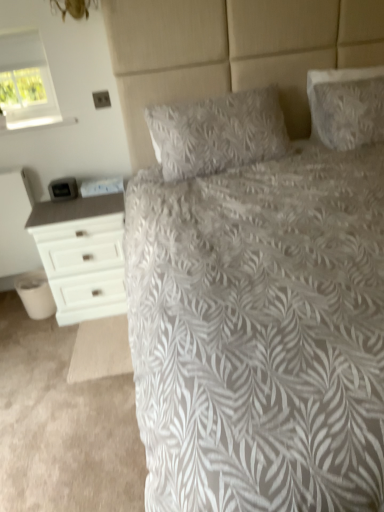
Describe the element at coordinates (16, 224) in the screenshot. I see `white painted wood nightstand at left` at that location.

Locate an element on the screen. white textured pillow at upper right, which ranks as the first pillow in right-to-left order is located at coordinates (347, 106).

Image resolution: width=384 pixels, height=512 pixels. What do you see at coordinates (26, 82) in the screenshot?
I see `white fabric window at upper left` at bounding box center [26, 82].

The width and height of the screenshot is (384, 512). What do you see at coordinates (80, 252) in the screenshot?
I see `white wood chest of drawers at left` at bounding box center [80, 252].

I want to click on white textured pillow at center, the second pillow in the right-to-left sequence, so click(x=218, y=133).

Is white textured pillow at center, positioned as the 1th pillow in left-to-right order, in front of or behind white textured bed at center in the image?

In the image, white textured pillow at center, positioned as the 1th pillow in left-to-right order, appears behind white textured bed at center.

How different are the orientations of white textured pillow at center, positioned as the 1th pillow in left-to-right order, and white textured bed at center in degrees?

There is a 1.22-degree angle between the facing directions of white textured pillow at center, positioned as the 1th pillow in left-to-right order, and white textured bed at center.

Can you confirm if white textured pillow at center, the second pillow in the right-to-left sequence, is smaller than white textured bed at center?

Correct, white textured pillow at center, the second pillow in the right-to-left sequence, occupies less space than white textured bed at center.

Is white textured pillow at center, the second pillow in the right-to-left sequence, facing towards white textured bed at center?

Yes, white textured pillow at center, the second pillow in the right-to-left sequence, faces towards white textured bed at center.

Is white wood chest of drawers at left to the left or to the right of white painted wood nightstand at left in the image?

white wood chest of drawers at left is positioned on white painted wood nightstand at left's right side.

Which of these two, white wood chest of drawers at left or white painted wood nightstand at left, stands shorter?

Standing shorter between the two is white wood chest of drawers at left.

Is white wood chest of drawers at left touching white painted wood nightstand at left?

No, white wood chest of drawers at left is not with white painted wood nightstand at left.

This screenshot has width=384, height=512. What are the coordinates of `chest of drawers located on the right of white painted wood nightstand at left` in the screenshot? It's located at (80, 252).

From the image's perspective, is white textured bed at center on white wood chest of drawers at left?

Correct, white textured bed at center appears higher than white wood chest of drawers at left in the image.

The width and height of the screenshot is (384, 512). Find the location of `chest of drawers lying on the left of white textured bed at center`. chest of drawers lying on the left of white textured bed at center is located at coordinates (80, 252).

Can you tell me how much white textured bed at center and white wood chest of drawers at left differ in facing direction?

3.6 degrees separate the facing orientations of white textured bed at center and white wood chest of drawers at left.

Is white fabric window at upper left taller or shorter than white wood chest of drawers at left?

Considering their sizes, white fabric window at upper left has less height than white wood chest of drawers at left.

Measure the distance between white fabric window at upper left and white wood chest of drawers at left.

30.23 inches.

This screenshot has height=512, width=384. In order to click on window located on the left of white wood chest of drawers at left in this screenshot , I will do `click(26, 82)`.

How many degrees apart are the facing directions of white textured bed at center and white textured pillow at upper right, the second pillow positioned from the left?

There is a 1.22-degree angle between the facing directions of white textured bed at center and white textured pillow at upper right, the second pillow positioned from the left.

From the image's perspective, which is below, white textured bed at center or white textured pillow at upper right, the second pillow positioned from the left?

white textured bed at center appears lower in the image.

Is white textured bed at center directly adjacent to white textured pillow at upper right, which ranks as the first pillow in right-to-left order?

No, white textured bed at center is not next to white textured pillow at upper right, which ranks as the first pillow in right-to-left order.

How much distance is there between white textured bed at center and white textured pillow at upper right, the second pillow positioned from the left?

white textured bed at center is 36.25 inches from white textured pillow at upper right, the second pillow positioned from the left.

From a real-world perspective, is white textured pillow at center, the second pillow in the right-to-left sequence, located higher than white textured pillow at upper right, the second pillow positioned from the left?

No, from a real-world perspective, white textured pillow at center, the second pillow in the right-to-left sequence, is not on top of white textured pillow at upper right, the second pillow positioned from the left.

Is white textured pillow at center, positioned as the 1th pillow in left-to-right order, facing towards white textured pillow at upper right, which ranks as the first pillow in right-to-left order?

No, white textured pillow at center, positioned as the 1th pillow in left-to-right order, is not facing towards white textured pillow at upper right, which ranks as the first pillow in right-to-left order.

Considering the sizes of objects white textured pillow at center, positioned as the 1th pillow in left-to-right order, and white textured pillow at upper right, the second pillow positioned from the left, in the image provided, who is wider, white textured pillow at center, positioned as the 1th pillow in left-to-right order, or white textured pillow at upper right, the second pillow positioned from the left,?

With larger width is white textured pillow at center, positioned as the 1th pillow in left-to-right order.

From the image's perspective, which one is positioned lower, white textured pillow at center, positioned as the 1th pillow in left-to-right order, or white textured pillow at upper right, which ranks as the first pillow in right-to-left order?

white textured pillow at center, positioned as the 1th pillow in left-to-right order, from the image's perspective.

Which is behind, white fabric window at upper left or white painted wood nightstand at left?

white painted wood nightstand at left is more distant.

The width and height of the screenshot is (384, 512). In order to click on window above the white painted wood nightstand at left (from a real-world perspective) in this screenshot , I will do `click(26, 82)`.

Can you confirm if white fabric window at upper left is positioned to the right of white painted wood nightstand at left?

Yes, white fabric window at upper left is to the right of white painted wood nightstand at left.

Image resolution: width=384 pixels, height=512 pixels. I want to click on bed on the right of white textured pillow at center, positioned as the 1th pillow in left-to-right order, so click(256, 314).

I want to click on nightstand that appears above the white wood chest of drawers at left (from a real-world perspective), so click(16, 224).

In the scene shown: Considering their positions, is white textured bed at center positioned further to white textured pillow at upper right, which ranks as the first pillow in right-to-left order, than white wood chest of drawers at left?

white wood chest of drawers at left is positioned further to the anchor white textured pillow at upper right, which ranks as the first pillow in right-to-left order.

Based on their spatial positions, is white textured pillow at upper right, the second pillow positioned from the left, or white wood chest of drawers at left closer to white textured bed at center?

Based on the image, white wood chest of drawers at left appears to be nearer to white textured bed at center.

Estimate the real-world distances between objects in this image. Which object is closer to white fabric window at upper left, white textured bed at center or white wood chest of drawers at left?

The object closer to white fabric window at upper left is white wood chest of drawers at left.

Which object lies further to the anchor point white fabric window at upper left, white painted wood nightstand at left or white textured bed at center?

The object further to white fabric window at upper left is white textured bed at center.

Considering their positions, is white textured bed at center positioned further to white painted wood nightstand at left than white textured pillow at center, the second pillow in the right-to-left sequence?

Among the two, white textured bed at center is located further to white painted wood nightstand at left.

Which object lies further to the anchor point white textured pillow at center, positioned as the 1th pillow in left-to-right order, white textured pillow at upper right, which ranks as the first pillow in right-to-left order, or white textured bed at center?

white textured bed at center is positioned further to the anchor white textured pillow at center, positioned as the 1th pillow in left-to-right order.

Considering their positions, is white painted wood nightstand at left positioned closer to white textured pillow at center, positioned as the 1th pillow in left-to-right order, than white wood chest of drawers at left?

Based on the image, white wood chest of drawers at left appears to be nearer to white textured pillow at center, positioned as the 1th pillow in left-to-right order.

When comparing their distances from white textured pillow at upper right, the second pillow positioned from the left, does white fabric window at upper left or white painted wood nightstand at left seem closer?

white fabric window at upper left lies closer to white textured pillow at upper right, the second pillow positioned from the left, than the other object.

Locate an element on the screen. The width and height of the screenshot is (384, 512). pillow between white wood chest of drawers at left and white textured pillow at upper right, the second pillow positioned from the left, from left to right is located at coordinates (218, 133).

The image size is (384, 512). I want to click on nightstand that lies between white fabric window at upper left and white wood chest of drawers at left from top to bottom, so click(x=16, y=224).

Where is `the chest of drawers located between white textured bed at center and white painted wood nightstand at left in the depth direction`? This screenshot has height=512, width=384. the chest of drawers located between white textured bed at center and white painted wood nightstand at left in the depth direction is located at coordinates (80, 252).

Find the location of a particular element. the chest of drawers situated between white fabric window at upper left and white textured pillow at center, positioned as the 1th pillow in left-to-right order, from left to right is located at coordinates (80, 252).